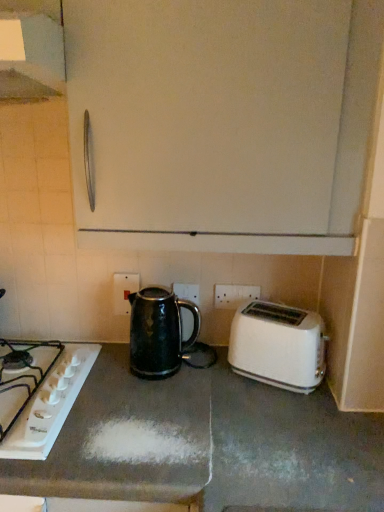
Question: From a real-world perspective, is white glossy gas stove at lower left above or below black glossy kettle at center?

Choices:
 (A) above
 (B) below

Answer: (B)

Question: Is white glossy gas stove at lower left to the left or to the right of black glossy kettle at center in the image?

Choices:
 (A) right
 (B) left

Answer: (B)

Question: Which of these objects is positioned farthest from the black glossy kettle at center?

Choices:
 (A) white plastic electric outlet at center, which is counted as the 2th electric outlet, starting from the right
 (B) metallic silver exhaust hood at upper left
 (C) white plastic electric outlet at center, positioned as the first electric outlet in right-to-left order
 (D) white glossy gas stove at lower left
 (E) white plastic toaster at lower right

Answer: (B)

Question: Based on their relative distances, which object is farther from the black glossy kettle at center?

Choices:
 (A) white plastic toaster at lower right
 (B) white plastic electric outlet at center, the first electric outlet from the left
 (C) white glossy gas stove at lower left
 (D) white plastic electric outlet at center, positioned as the first electric outlet in right-to-left order
 (E) metallic silver exhaust hood at upper left

Answer: (E)